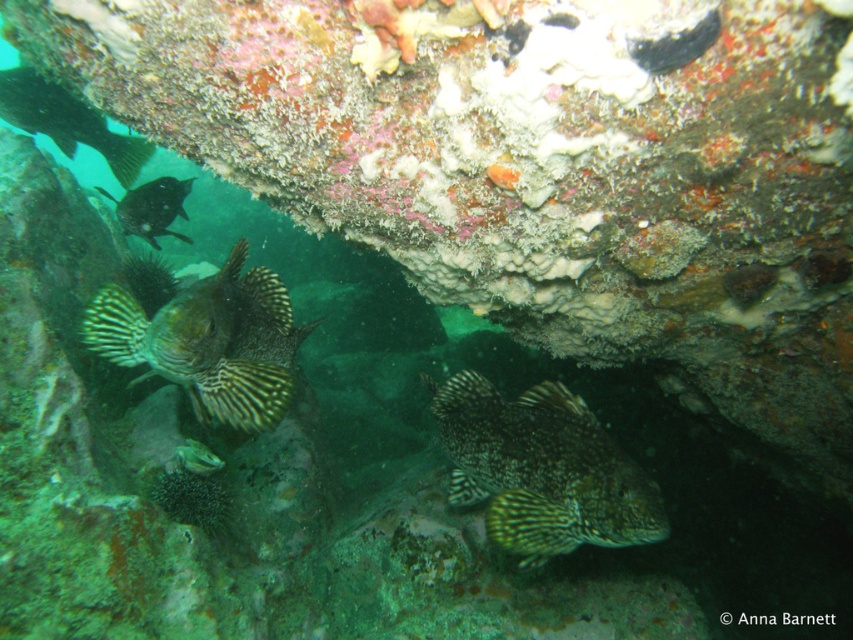
Between green striped fish at center and shiny black fish at upper left, which one appears on the right side from the viewer's perspective?

Positioned to the right is green striped fish at center.

Between green striped fish at center and shiny black fish at upper left, which one is positioned higher?

Positioned higher is shiny black fish at upper left.

Image resolution: width=853 pixels, height=640 pixels. I want to click on green striped fish at center, so click(x=204, y=337).

Where is `green striped fish at center`? green striped fish at center is located at coordinates (204, 337).

Is green striped fish at upper left to the left of shiny black fish at upper left from the viewer's perspective?

Indeed, green striped fish at upper left is positioned on the left side of shiny black fish at upper left.

Is green striped fish at upper left to the right of shiny black fish at upper left from the viewer's perspective?

No, green striped fish at upper left is not to the right of shiny black fish at upper left.

You are a GUI agent. You are given a task and a screenshot of the screen. Output one action in this format:
    pyautogui.click(x=<x>, y=<y>)
    Task: Click on the green striped fish at upper left
    This screenshot has width=853, height=640.
    Given the screenshot: What is the action you would take?
    pyautogui.click(x=67, y=122)

Does green speckled fish at center have a lesser width compared to shiny black fish at upper left?

In fact, green speckled fish at center might be wider than shiny black fish at upper left.

Where is `green speckled fish at center`? This screenshot has height=640, width=853. green speckled fish at center is located at coordinates (541, 468).